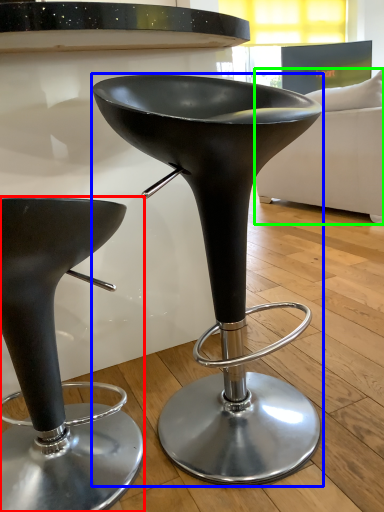
Question: Estimate the real-world distances between objects in this image. Which object is closer to stool (highlighted by a red box), stool (highlighted by a blue box) or couch (highlighted by a green box)?

Choices:
 (A) stool
 (B) couch

Answer: (A)